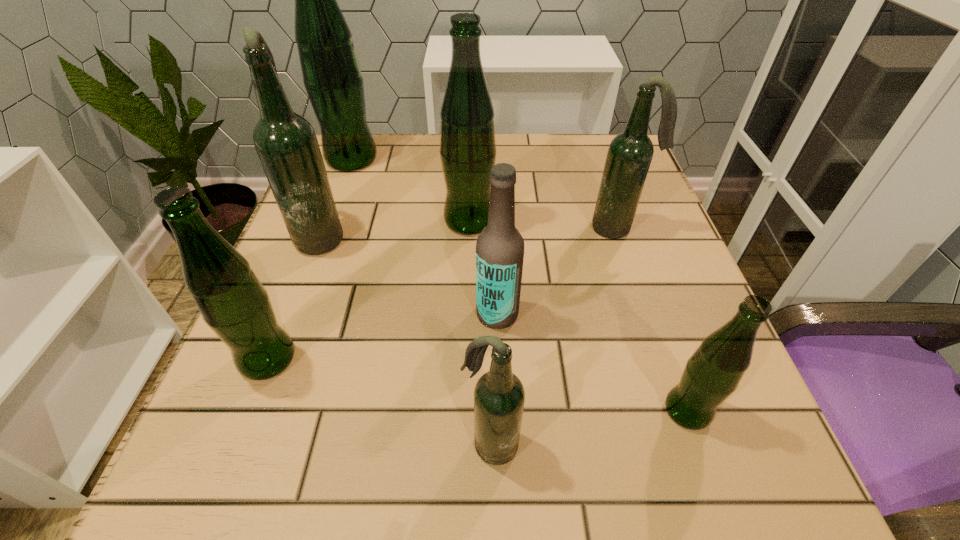
Locate an element on the screen. The image size is (960, 540). free space located on the label of the fifth farthest beer bottle is located at coordinates (355, 314).

The height and width of the screenshot is (540, 960). I want to click on free space located on the back of the smallest green beer bottle, so click(x=655, y=319).

At what (x,y) coordinates should I click in order to perform the action: click on blank area located 0.270m on the back of the second dark beer bottle from right to left. Please return your answer as a coordinate pair (x, y). The height and width of the screenshot is (540, 960). Looking at the image, I should click on (488, 279).

Image resolution: width=960 pixels, height=540 pixels. I want to click on object at the far edge, so click(333, 80).

Identify the location of object situated at the near edge. This screenshot has height=540, width=960. (499, 396).

You are a GUI agent. You are given a task and a screenshot of the screen. Output one action in this format:
    pyautogui.click(x=<x>, y=<y>)
    Task: Click on the object present at the far left corner
    This screenshot has height=540, width=960.
    Given the screenshot: What is the action you would take?
    pyautogui.click(x=333, y=80)

At what (x,y) coordinates should I click in order to perform the action: click on free spot at the far edge of the desktop. Please return your answer as a coordinate pair (x, y). Looking at the image, I should click on (517, 134).

This screenshot has width=960, height=540. Identify the location of vacant space at the near edge of the desktop. (467, 509).

The image size is (960, 540). What are the coordinates of `blank space at the left edge of the desktop` in the screenshot? It's located at (348, 321).

This screenshot has height=540, width=960. What are the coordinates of `vacant space at the right edge` in the screenshot? It's located at (717, 443).